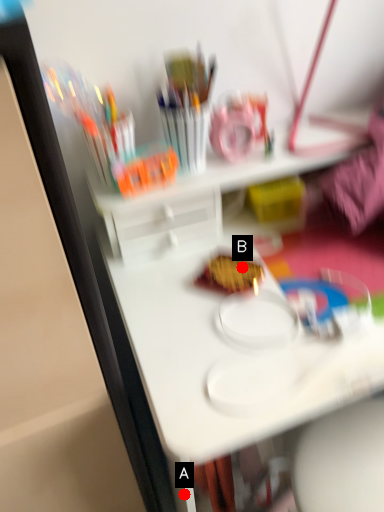
Question: Two points are circled on the image, labeled by A and B beside each circle. Among these points, which one is farthest from the camera?

Choices:
 (A) A is further
 (B) B is further

Answer: (B)